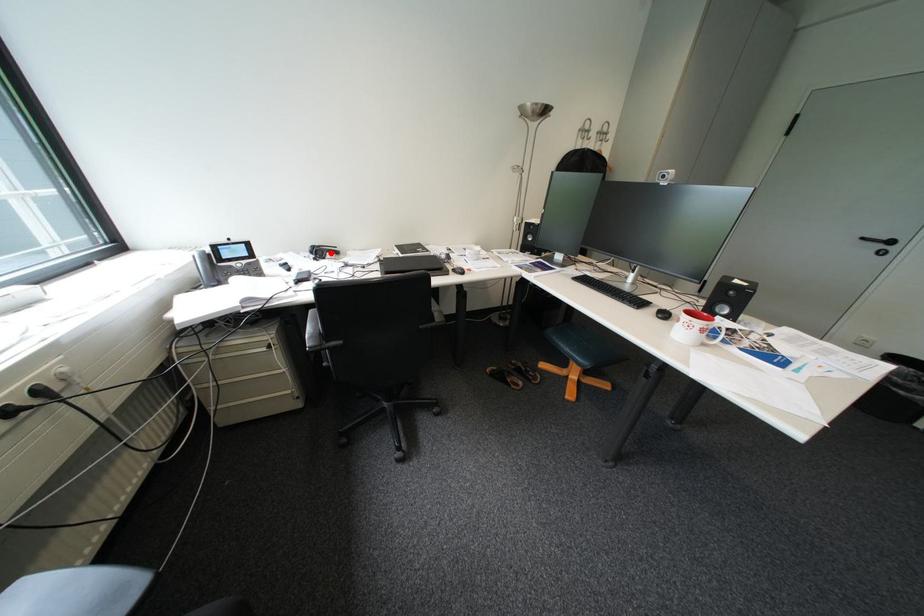
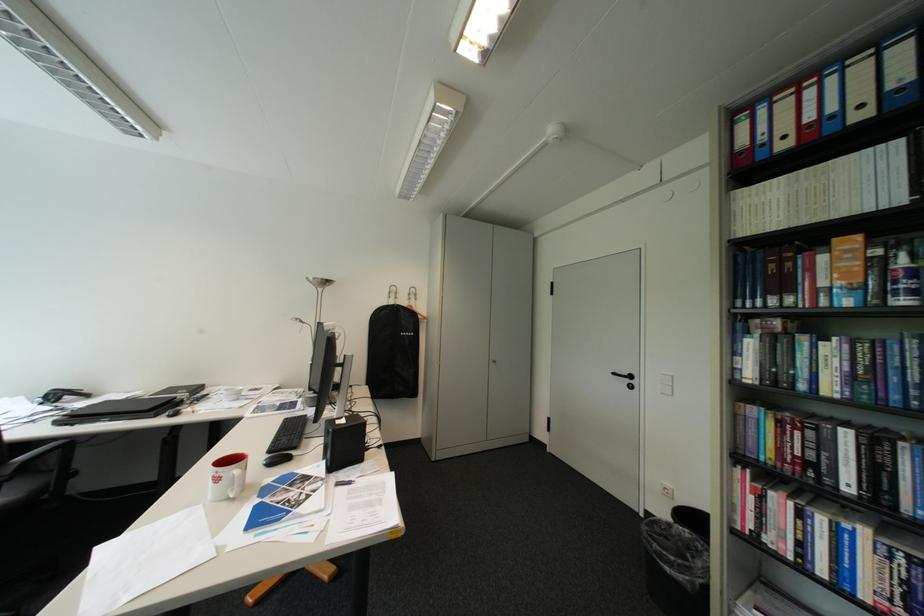
In the second image, find the point that corresponds to the highlighted location in the first image.

(67, 397)